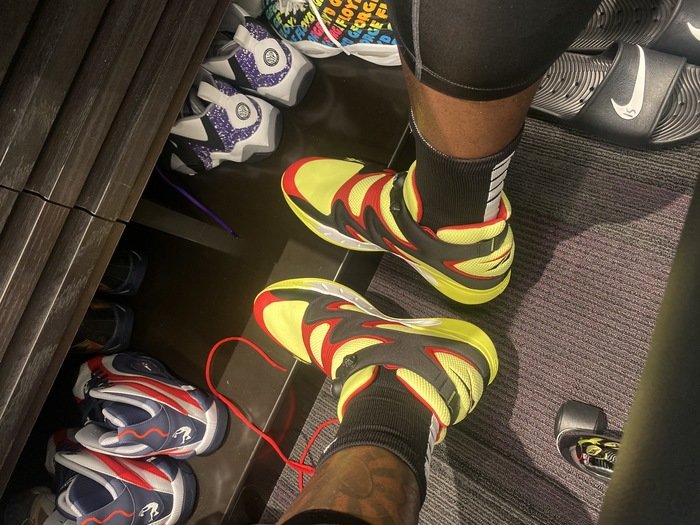
This screenshot has width=700, height=525. In order to click on dark carpet floor in this screenshot , I will do `click(264, 451)`.